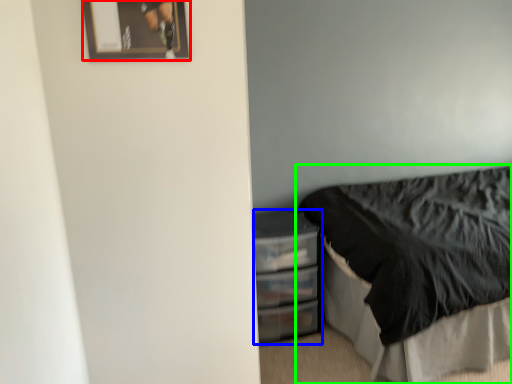
Question: Which is nearer to the picture frame (highlighted by a red box)? file cabinet (highlighted by a blue box) or bed (highlighted by a green box).

Choices:
 (A) file cabinet
 (B) bed

Answer: (A)